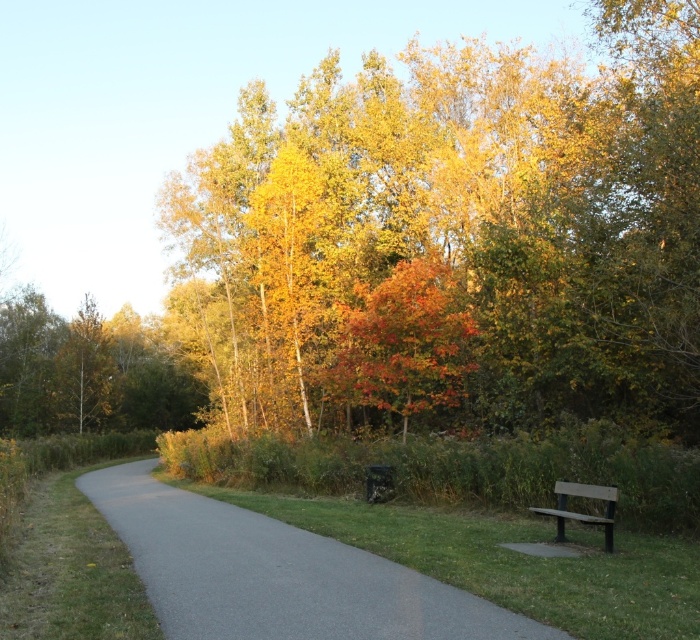
Is point (231, 522) positioned behind point (610, 509)?

Yes.

Is gray asphalt path at center taller than brown wooden bench at lower right?

Correct, gray asphalt path at center is much taller as brown wooden bench at lower right.

Describe the element at coordinates (276, 573) in the screenshot. I see `gray asphalt path at center` at that location.

At what (x,y) coordinates should I click in order to perform the action: click on gray asphalt path at center. Please return your answer as a coordinate pair (x, y). The image size is (700, 640). Looking at the image, I should click on (276, 573).

Does point (673, 284) come behind point (344, 321)?

No.

Is golden yellow leaves at upper center behind shiny orange leaves at center?

No.

The width and height of the screenshot is (700, 640). I want to click on golden yellow leaves at upper center, so click(x=455, y=240).

Who is higher up, golden yellow leaves at upper center or brown wooden bench at lower right?

golden yellow leaves at upper center

Who is more forward, (284, 305) or (578, 518)?

Positioned in front is point (578, 518).

This screenshot has width=700, height=640. Describe the element at coordinates (455, 240) in the screenshot. I see `golden yellow leaves at upper center` at that location.

Locate an element on the screen. golden yellow leaves at upper center is located at coordinates (455, 240).